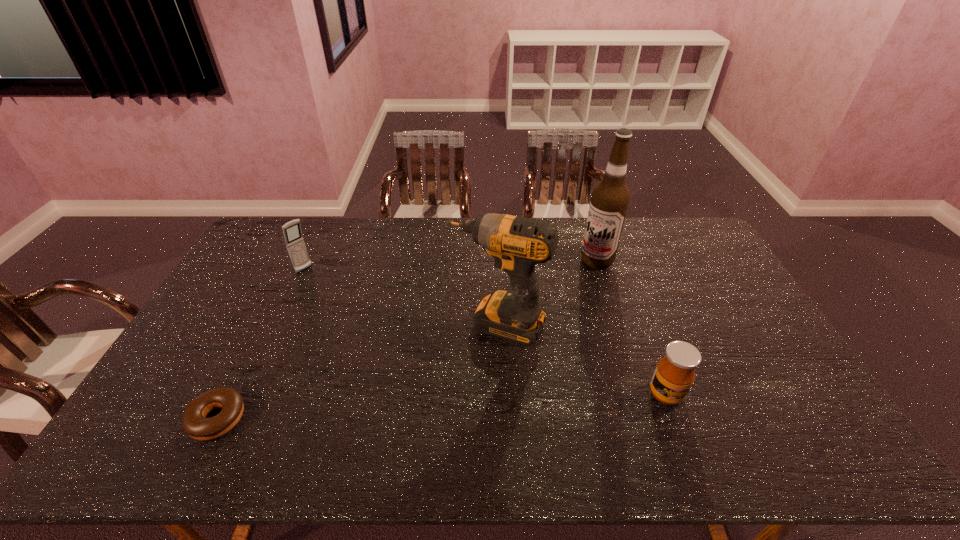
You are a GUI agent. You are given a task and a screenshot of the screen. Output one action in this format:
    pyautogui.click(x=<x>, y=<y>)
    Task: Click on the doughnut
    
    Given the screenshot: What is the action you would take?
    pyautogui.click(x=194, y=423)

Image resolution: width=960 pixels, height=540 pixels. Identify the location of honey. (674, 375).

Locate an element on the screen. This screenshot has width=960, height=540. the third tallest object is located at coordinates (294, 241).

Locate an element on the screen. the second tallest object is located at coordinates (517, 243).

The width and height of the screenshot is (960, 540). Identify the location of the third object from right to left. (517, 243).

Where is `alcohol`? alcohol is located at coordinates (609, 201).

Locate an element on the screen. This screenshot has height=540, width=960. vacant area situated 0.350m on the right of the doughnut is located at coordinates (385, 418).

Find the location of a particular element. free spot located 0.080m on the front-facing side of the third shortest object is located at coordinates (322, 284).

Find the location of a particular element. This screenshot has height=540, width=960. vacant space positioned on the front-facing side of the third shortest object is located at coordinates (378, 330).

Image resolution: width=960 pixels, height=540 pixels. I want to click on vacant area located on the front-facing side of the third shortest object, so click(319, 281).